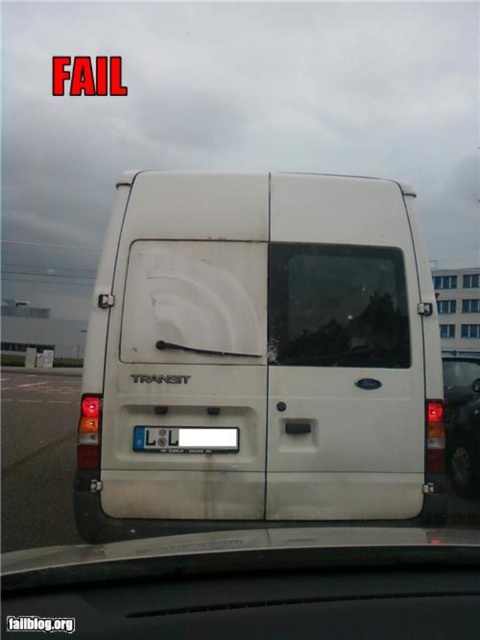
Question: Which object is farther from the camera taking this photo?

Choices:
 (A) transparent glass windshield at center
 (B) white matte van at center
 (C) matte white van at center

Answer: (C)

Question: Estimate the real-world distances between objects in this image. Which object is farther from the white plastic license plate at center?

Choices:
 (A) transparent glass windshield at center
 (B) matte white van at center

Answer: (B)

Question: Does matte white van at center appear over white plastic license plate at center?

Choices:
 (A) yes
 (B) no

Answer: (B)

Question: Considering the relative positions of matte white van at center and white plastic license plate at center in the image provided, where is matte white van at center located with respect to white plastic license plate at center?

Choices:
 (A) right
 (B) left

Answer: (A)

Question: Can you confirm if white matte van at center is smaller than matte white van at center?

Choices:
 (A) yes
 (B) no

Answer: (A)

Question: Which point is farther to the camera?

Choices:
 (A) (195, 445)
 (B) (317, 291)

Answer: (B)